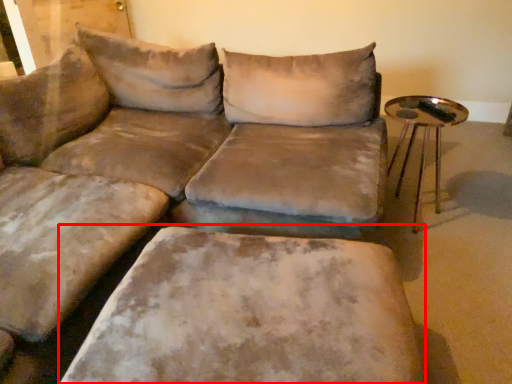
Question: Observing the image, what is the correct spatial positioning of swivel chair (annotated by the red box) in reference to table?

Choices:
 (A) right
 (B) left

Answer: (B)